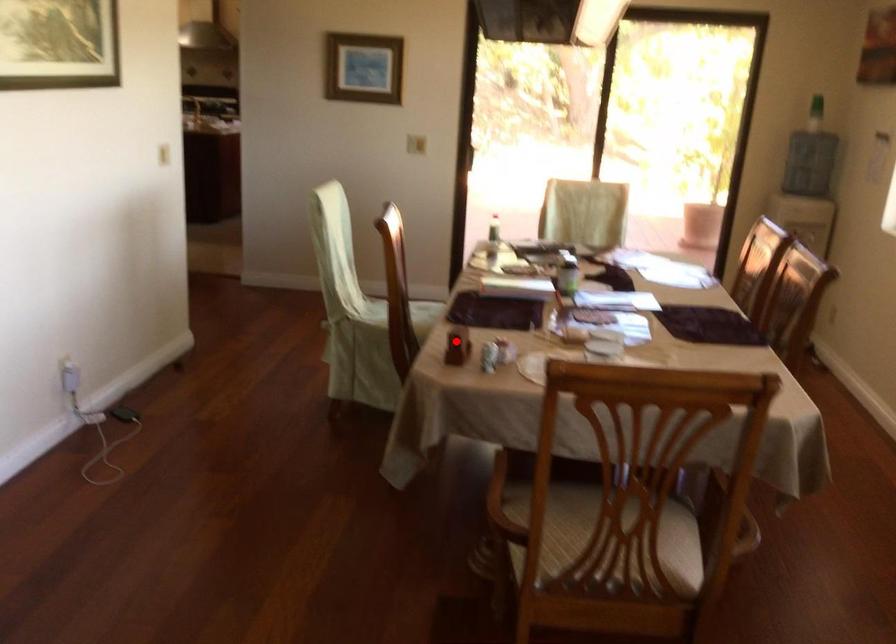
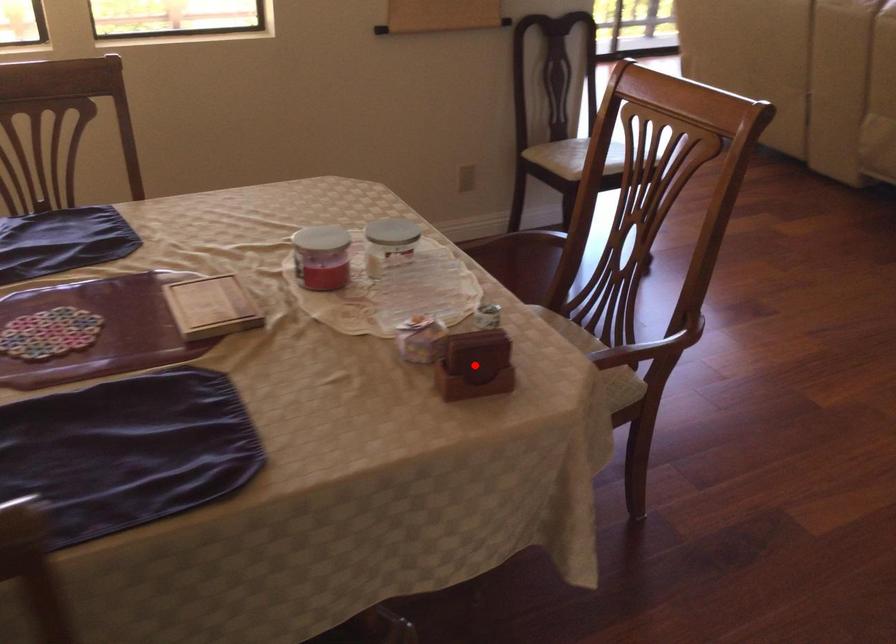
I am providing you with two images of the same scene from different viewpoints. A red point is marked on the first image and another point is marked on the second image. Are the points marked in image1 and image2 representing the same 3D position?

Yes